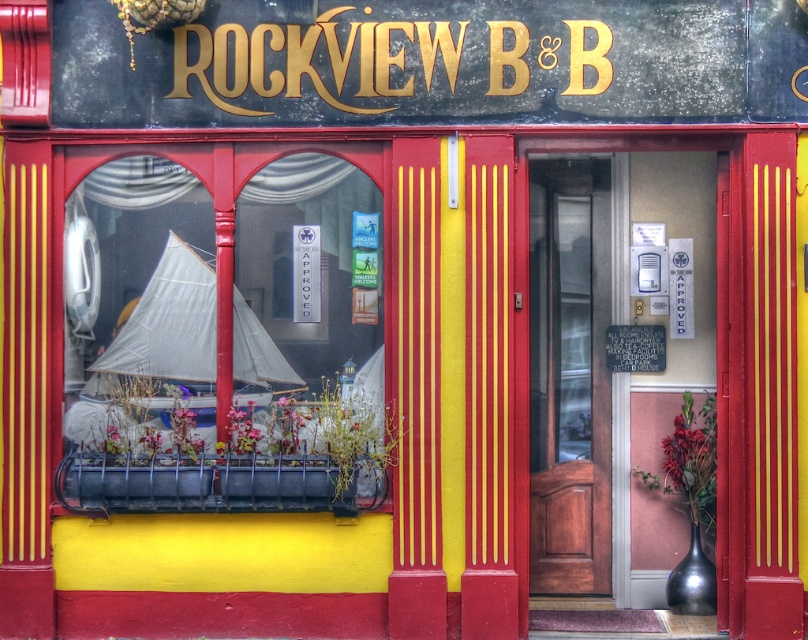
You are a delivery person arriving at Rockview BBBBB. You need to deliver a package to the front desk. The package is too large to fit through the wooden door at center. Can you use the gold metallic sign at upper center instead?

The wooden door at center is thinner than the gold metallic sign at upper center. Since the package is too large for the door, it cannot be passed through the sign either, as the sign is wider but not an opening.

You are a guest arriving at Rockview BBBBB. You see the mahogany wood door at center and the gold metallic sign at upper center. Which object is located higher up on the building?

The gold metallic sign at upper center is located higher up on the building than the mahogany wood door at center.